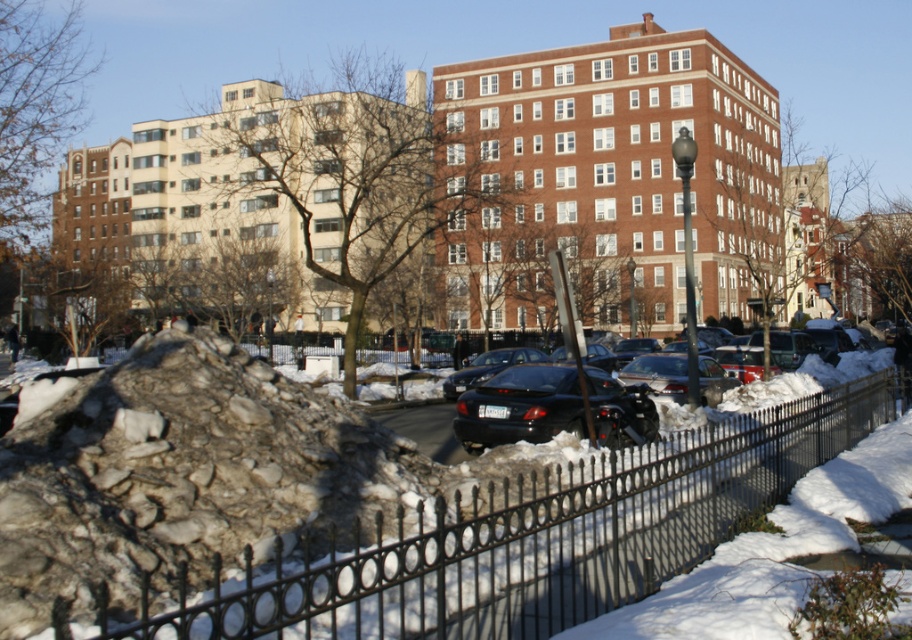
Is black wrought iron fence at lower center positioned behind rocky debris at lower left?

No, black wrought iron fence at lower center is closer to the viewer.

Is point (472, 579) closer to viewer compared to point (330, 403)?

Yes, it is in front of point (330, 403).

Who is more distant from viewer, (406, 577) or (117, 516)?

Point (117, 516)

At what (x,y) coordinates should I click in order to perform the action: click on black wrought iron fence at lower center. Please return your answer as a coordinate pair (x, y). Looking at the image, I should click on (529, 538).

Is black wrought iron fence at lower center further to the viewer compared to shiny black sedan at center?

That is False.

In the scene shown: Measure the distance from black wrought iron fence at lower center to shiny black sedan at center.

They are 16.46 feet apart.

Based on the photo, who is more distant from viewer, (526, 609) or (867, 364)?

The point (867, 364) is behind.

The height and width of the screenshot is (640, 912). What are the coordinates of `black wrought iron fence at lower center` in the screenshot? It's located at (529, 538).

Is point (802, 412) in front of point (475, 410)?

Yes, point (802, 412) is in front of point (475, 410).

Between black wrought iron fence at lower center and black matte car at center, which one appears on the right side from the viewer's perspective?

Positioned to the right is black wrought iron fence at lower center.

Image resolution: width=912 pixels, height=640 pixels. I want to click on black wrought iron fence at lower center, so click(529, 538).